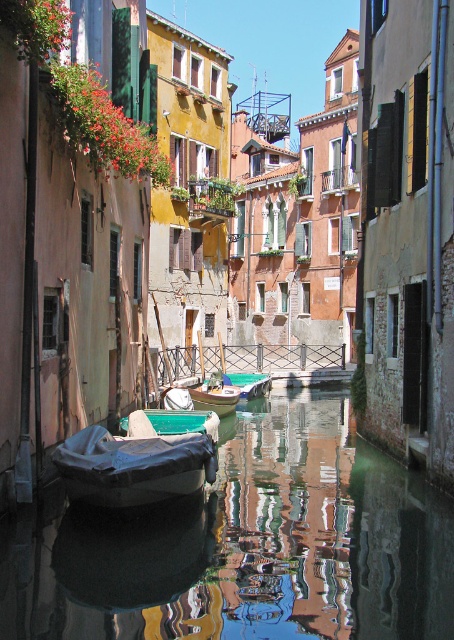
Question: Which of the following is the closest to the observer?

Choices:
 (A) dark blue tarpaulin boat at center
 (B) wooden boat at center

Answer: (A)

Question: In this image, where is dark blue tarpaulin boat at center located relative to green plastic boat at center?

Choices:
 (A) below
 (B) above

Answer: (A)

Question: Is teal plastic boat at center positioned behind wooden boat at center?

Choices:
 (A) no
 (B) yes

Answer: (A)

Question: Estimate the real-world distances between objects in this image. Which object is farther from the wooden boat at center?

Choices:
 (A) teal plastic boat at center
 (B) dark blue tarpaulin boat at center
 (C) smooth reflective water at center

Answer: (B)

Question: Which point is farther from the camera taking this photo?

Choices:
 (A) (207, 424)
 (B) (258, 384)
 (C) (266, 506)

Answer: (B)

Question: Does dark blue tarpaulin boat at center have a lesser width compared to teal plastic boat at center?

Choices:
 (A) yes
 (B) no

Answer: (B)